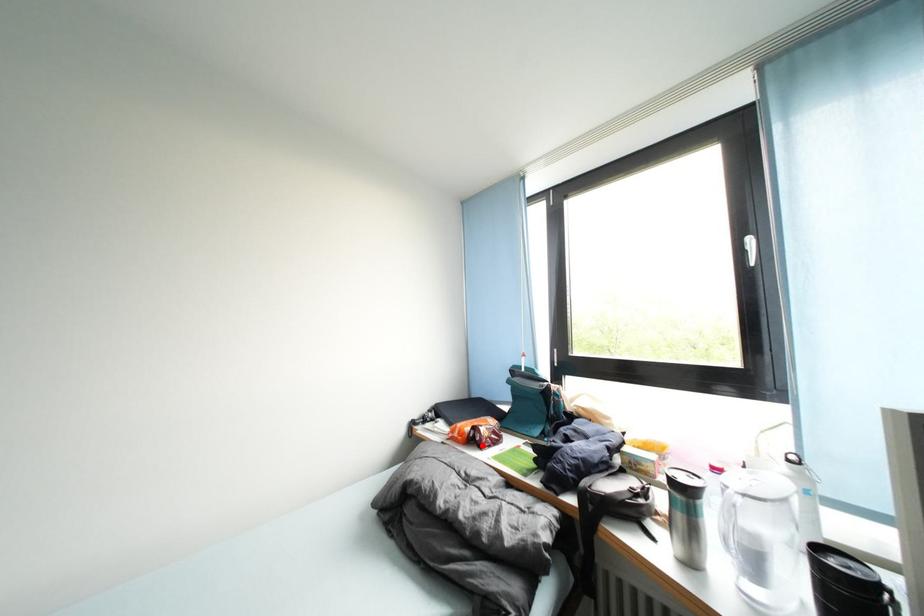
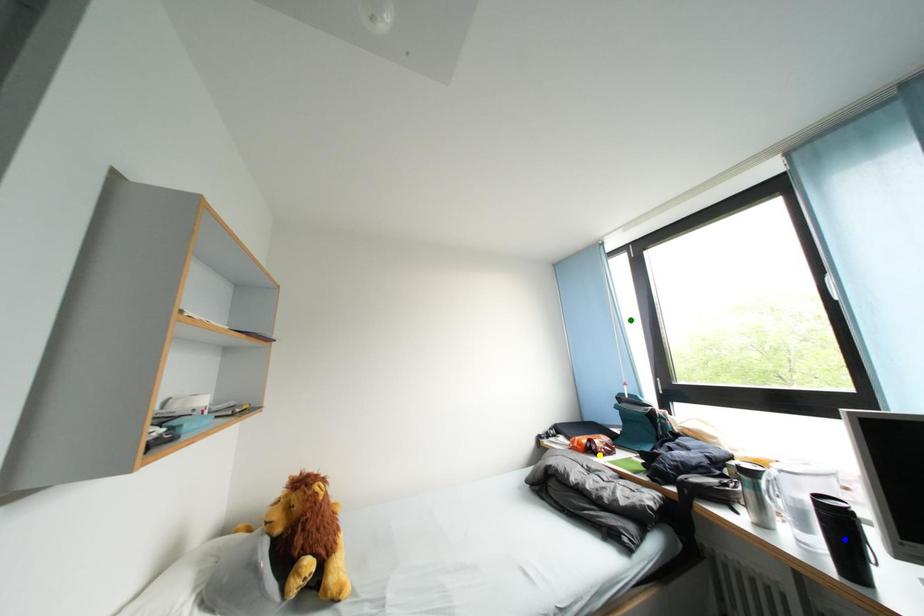
Question: I am providing you with two images of the same scene from different viewpoints. A red point is marked on the first image. You are given multiple points on the second image. In image 2, which mark is for the same physical point as the one in image 1?

Choices:
 (A) blue point
 (B) green point
 (C) yellow point

Answer: (C)